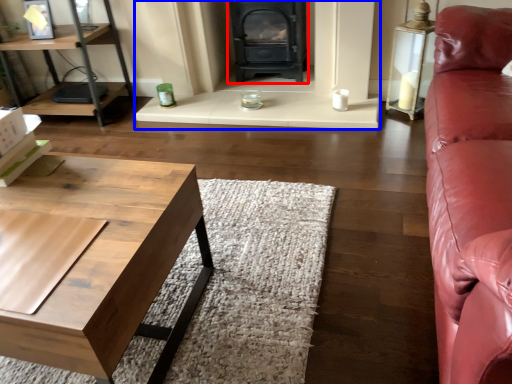
Question: Which of the following is the farthest to the observer, wood burning stove (highlighted by a red box) or fireplace (highlighted by a blue box)?

Choices:
 (A) wood burning stove
 (B) fireplace

Answer: (A)